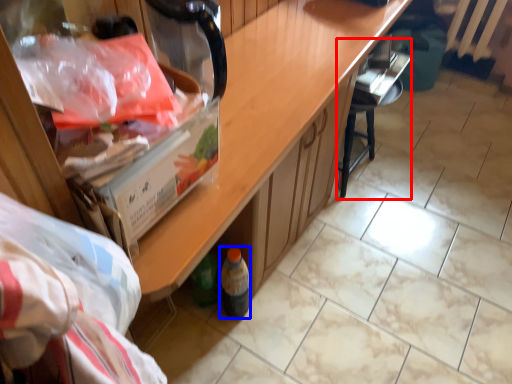
Question: Which object is further to the camera taking this photo, chair (highlighted by a red box) or wine bottle (highlighted by a blue box)?

Choices:
 (A) chair
 (B) wine bottle

Answer: (A)